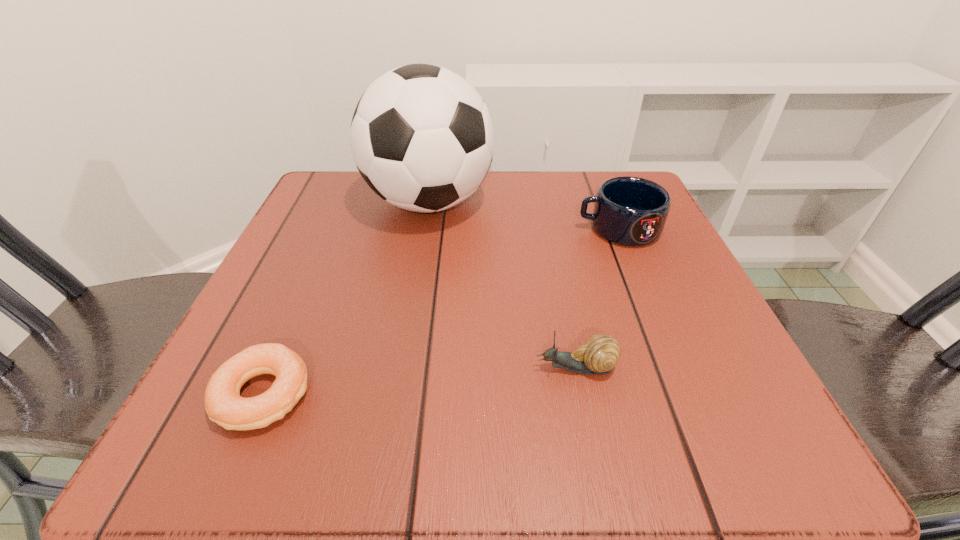
The image size is (960, 540). Find the location of `vacant space that is in between the shortest object and the third object from left to right`. vacant space that is in between the shortest object and the third object from left to right is located at coordinates (420, 381).

Locate an element on the screen. This screenshot has height=540, width=960. free area in between the escargot and the mug is located at coordinates (597, 298).

I want to click on blank region between the third object from left to right and the soccer ball, so click(502, 285).

Locate an element on the screen. This screenshot has height=540, width=960. vacant area that lies between the third object from left to right and the mug is located at coordinates (597, 298).

What are the coordinates of `free space between the mug and the tallest object` in the screenshot? It's located at (524, 215).

Locate an element on the screen. This screenshot has width=960, height=540. vacant space in between the escargot and the second tallest object is located at coordinates (597, 298).

Find the location of a particular element. This screenshot has width=960, height=540. vacant region between the third tallest object and the soccer ball is located at coordinates (502, 285).

Locate an element on the screen. free space between the tallest object and the shortest object is located at coordinates (347, 299).

I want to click on empty space between the bagel and the second object from right to left, so click(x=420, y=381).

What are the coordinates of `object that is the closest one to the escargot` in the screenshot? It's located at (631, 211).